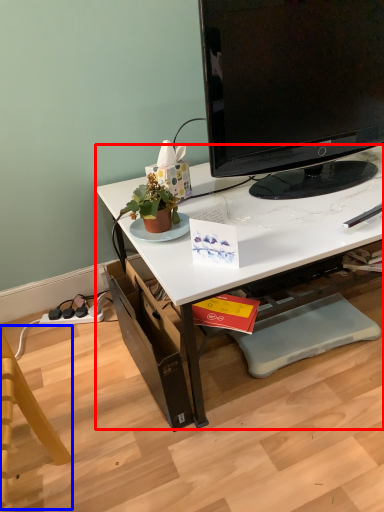
Question: Which point is further to the camera, desk (highlighted by a red box) or swivel chair (highlighted by a blue box)?

Choices:
 (A) desk
 (B) swivel chair

Answer: (A)